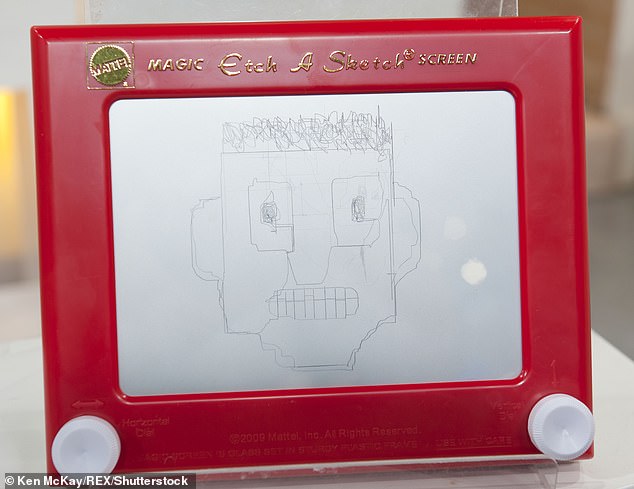
This screenshot has width=634, height=489. I want to click on table, so click(x=624, y=385).